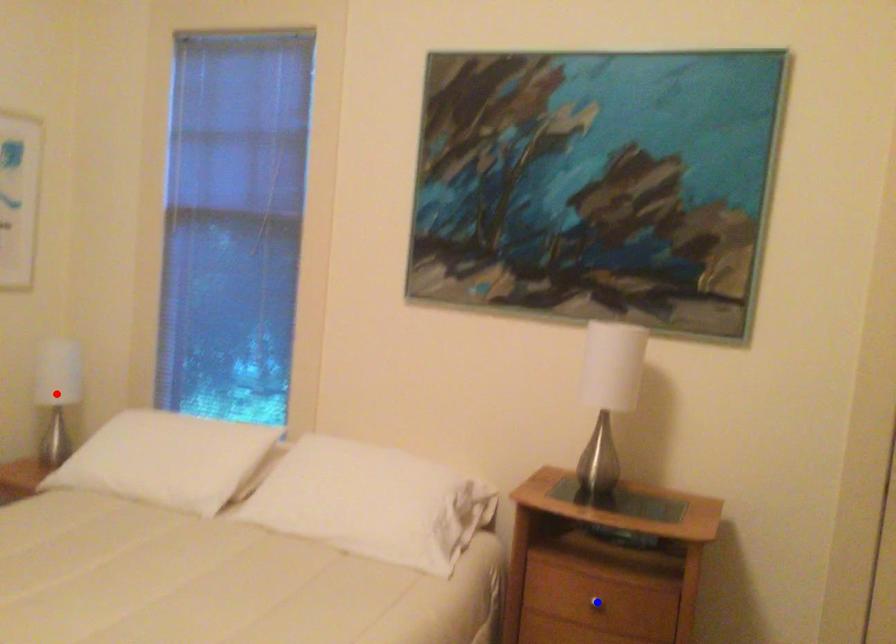
Question: Two points are marked on the image. Which point is closer to the camera?

Choices:
 (A) Blue point is closer.
 (B) Red point is closer.

Answer: (A)